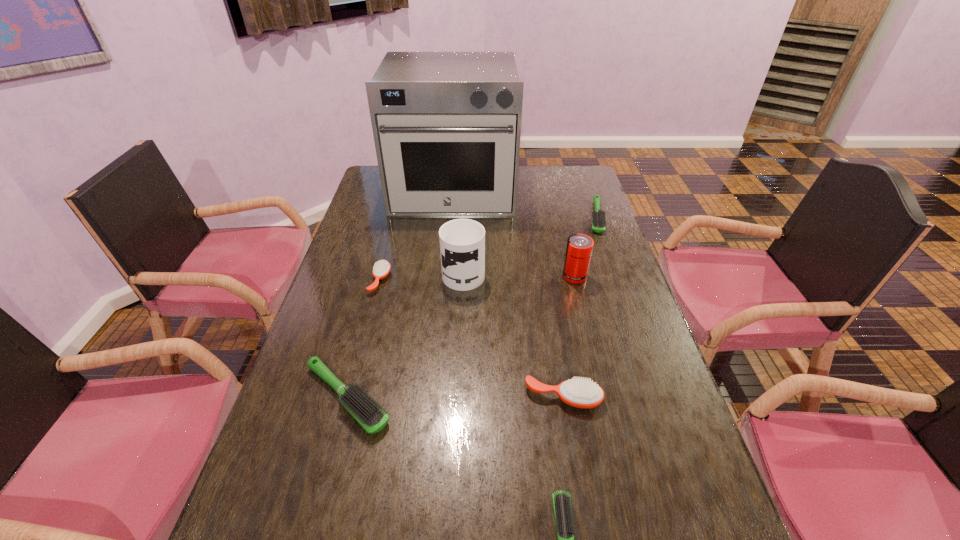
You are a GUI agent. You are given a task and a screenshot of the screen. Output one action in this format:
    pyautogui.click(x=<x>, y=<y>)
    Task: Click on the light hairbrush object that ranks as the second closest to the biggest light hairbrush
    Image resolution: width=960 pixels, height=540 pixels.
    Given the screenshot: What is the action you would take?
    pyautogui.click(x=598, y=216)

The image size is (960, 540). In order to click on free space that satisfies the following two spatial constraints: 1. on the back side of the leftmost light hairbrush; 2. on the left side of the sixth shortest object in this screenshot , I will do `click(378, 276)`.